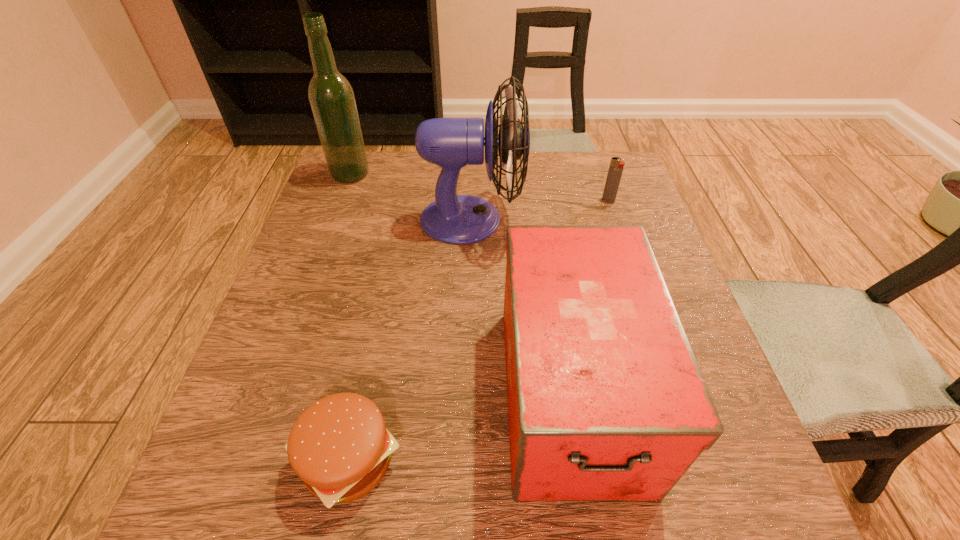
Locate an element on the screen. This screenshot has height=540, width=960. vacant space located 0.300m on the right of the hamburger is located at coordinates (602, 459).

This screenshot has height=540, width=960. I want to click on liquor that is at the far edge, so click(x=332, y=100).

Locate an element on the screen. fan situated at the far edge is located at coordinates (454, 142).

The width and height of the screenshot is (960, 540). I want to click on igniter located in the far edge section of the desktop, so (x=616, y=167).

The image size is (960, 540). In order to click on the first-aid kit at the near edge in this screenshot , I will do `click(606, 401)`.

What are the coordinates of `hamburger that is at the near edge` in the screenshot? It's located at pos(339,446).

Locate an element on the screen. This screenshot has height=540, width=960. liquor located in the left edge section of the desktop is located at coordinates (332, 100).

At what (x,y) coordinates should I click in order to perform the action: click on hamburger situated at the left edge. Please return your answer as a coordinate pair (x, y). The width and height of the screenshot is (960, 540). Looking at the image, I should click on (339, 446).

I want to click on the first-aid kit that is at the right edge, so click(x=606, y=401).

Find the location of `igniter situated at the right edge`. igniter situated at the right edge is located at coordinates (616, 167).